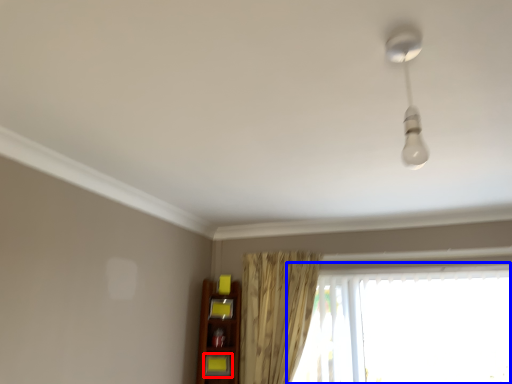
Question: Which point is closer to the camera, shelf (highlighted by a red box) or window (highlighted by a blue box)?

Choices:
 (A) shelf
 (B) window

Answer: (B)